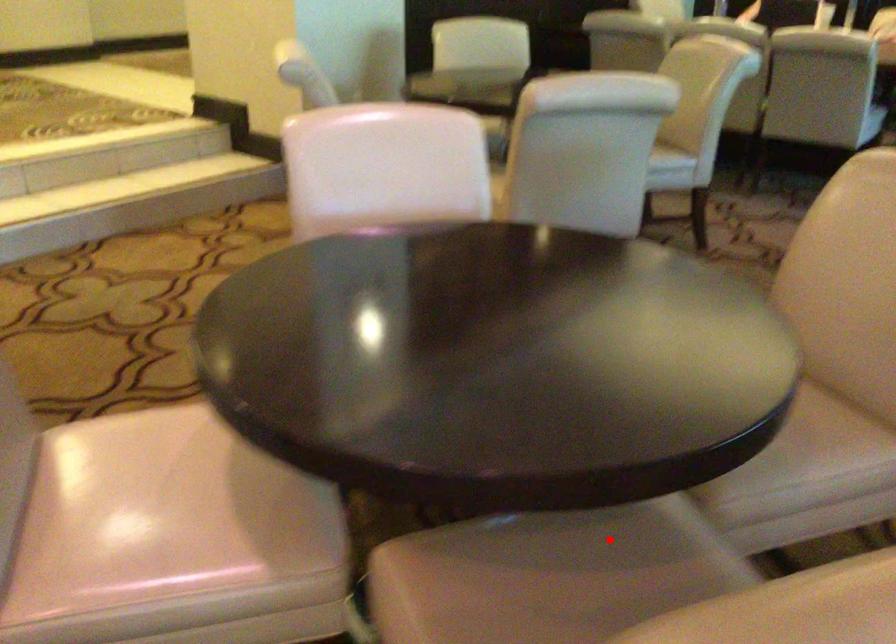
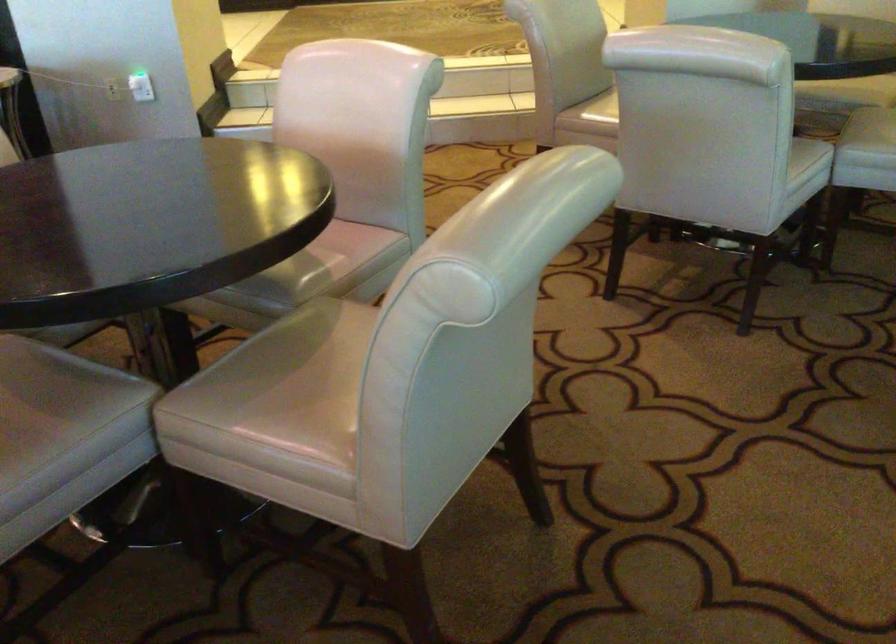
The point at the highlighted location is marked in the first image. Where is the corresponding point in the second image?

(56, 389)